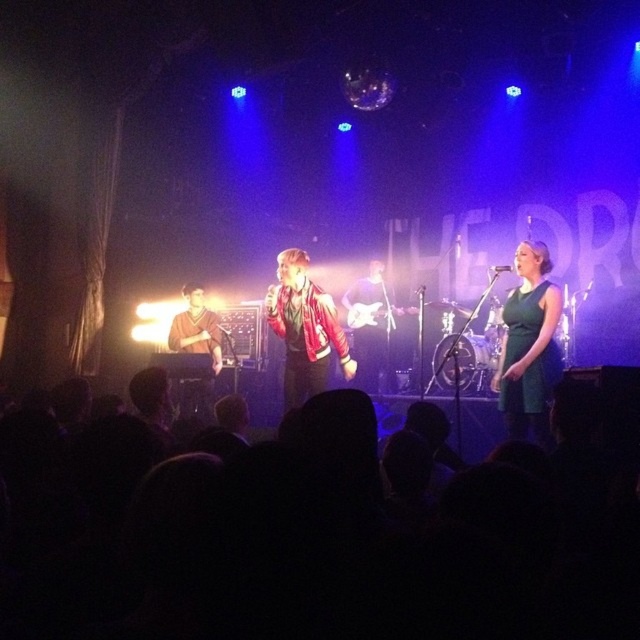
Question: Is shiny red jacket at center to the left of brown leather jacket at left from the viewer's perspective?

Choices:
 (A) yes
 (B) no

Answer: (B)

Question: Which point appears farthest from the camera in this image?

Choices:
 (A) (371, 324)
 (B) (188, 397)

Answer: (A)

Question: Which is nearer to the green satin dress at center?

Choices:
 (A) reddish-brown leather jacket at center
 (B) shiny red jacket at center
 (C) brown leather jacket at left

Answer: (B)

Question: Which point is farther to the camera?

Choices:
 (A) (531, 378)
 (B) (193, 298)
 (C) (374, 266)
 (D) (296, 365)

Answer: (C)

Question: Does shiny red jacket at center appear on the right side of reddish-brown leather jacket at center?

Choices:
 (A) no
 (B) yes

Answer: (A)

Question: In this image, where is shiny red jacket at center located relative to reddish-brown leather jacket at center?

Choices:
 (A) left
 (B) right

Answer: (A)